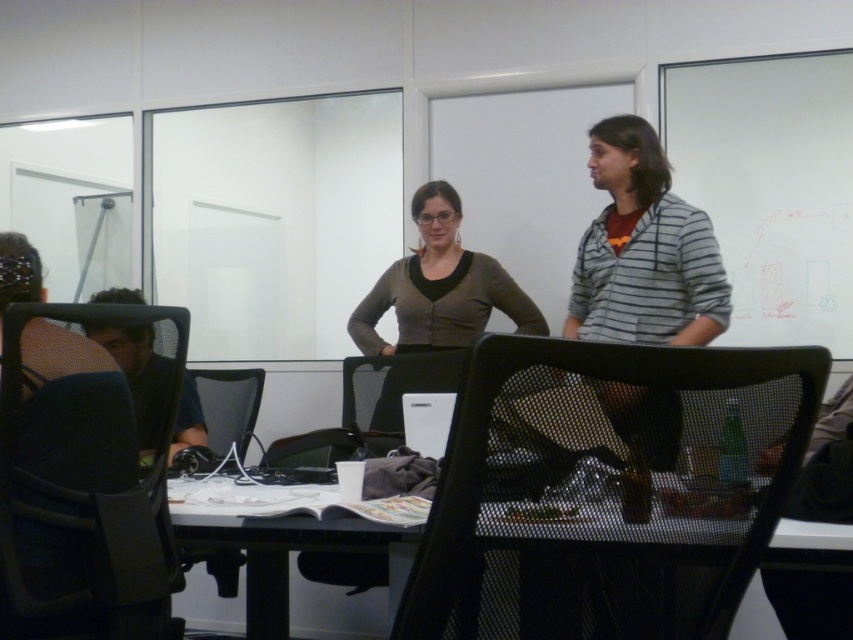
Does black mesh table at center appear under dark blue shirt at left?

Indeed, black mesh table at center is positioned under dark blue shirt at left.

Does black mesh table at center have a smaller size compared to dark blue shirt at left?

No.

You are a GUI agent. You are given a task and a screenshot of the screen. Output one action in this format:
    pyautogui.click(x=<x>, y=<y>)
    Task: Click on the black mesh table at center
    This screenshot has width=853, height=640.
    Given the screenshot: What is the action you would take?
    pyautogui.click(x=252, y=529)

Consider the image. Can you confirm if matte brown cardigan at center is wider than black mesh table at center?

Yes, matte brown cardigan at center is wider than black mesh table at center.

You are a GUI agent. You are given a task and a screenshot of the screen. Output one action in this format:
    pyautogui.click(x=<x>, y=<y>)
    Task: Click on the matte brown cardigan at center
    
    Given the screenshot: What is the action you would take?
    pyautogui.click(x=440, y=288)

Is matte brown cardigan at center further to the viewer compared to dark blue shirt at left?

Yes.

Between matte brown cardigan at center and dark blue shirt at left, which one appears on the right side from the viewer's perspective?

From the viewer's perspective, matte brown cardigan at center appears more on the right side.

Locate an element on the screen. This screenshot has height=640, width=853. matte brown cardigan at center is located at coordinates (440, 288).